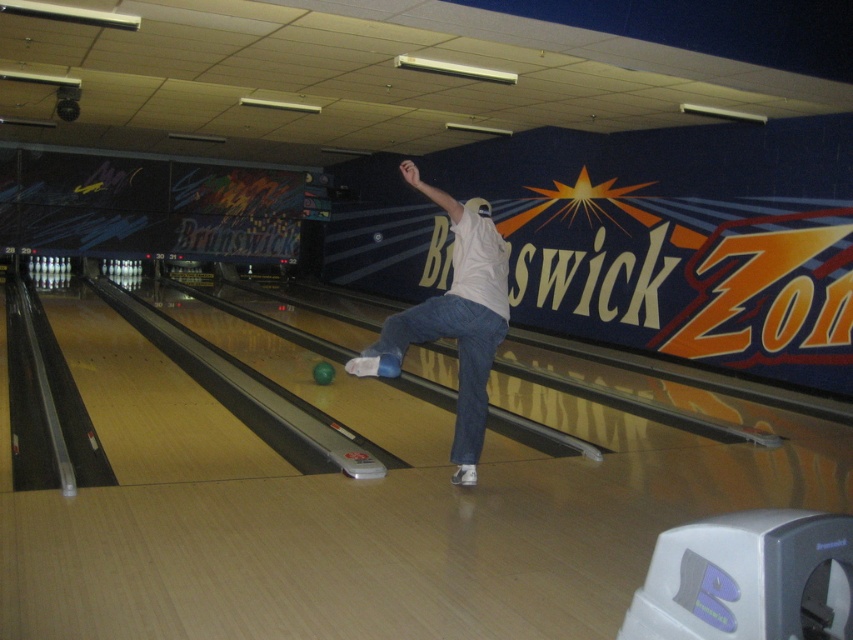
You are a photographer positioned at the end of the bowling lane. You need to capture a closeup shot of the white matte shirt at center and the blue denim jeans at center. Which object should you zoom in on first if you want to focus on the wider one?

The white matte shirt at center might be wider than blue denim jeans at center, so you should zoom in on the white matte shirt at center first to focus on the wider one.

You are a photographer positioned at the back of the bowling alley, aiming to capture the bowler in action. Your focus is on the white matte shirt at center and the blue denim jeans at center. From your perspective, which item is positioned to the left?

The white matte shirt at center is to the left of the blue denim jeans at center.

You are a photographer at the bowling alley and want to capture the person wearing the white matte shirt at center and blue denim jeans at center. Which piece of clothing is positioned higher on their body?

The white matte shirt at center is located above the blue denim jeans at center, so the white matte shirt at center is positioned higher on their body.